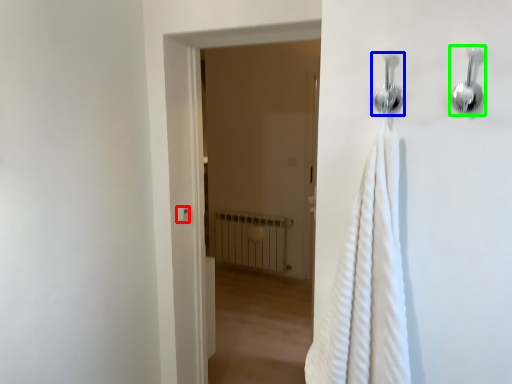
Question: Estimate the real-world distances between objects in this image. Which object is closer to light switch (highlighted by a red box), shower (highlighted by a blue box) or shower (highlighted by a green box)?

Choices:
 (A) shower
 (B) shower

Answer: (A)